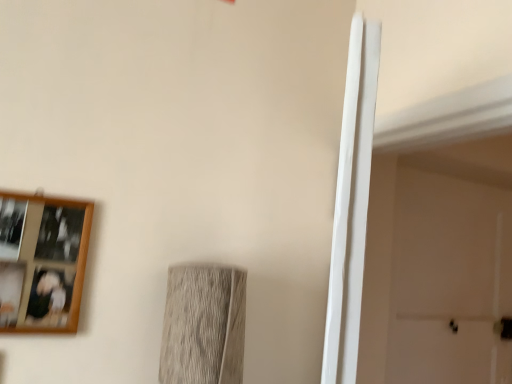
Question: Is wooden picture frame at upper left bigger or smaller than white matte door at right?

Choices:
 (A) small
 (B) big

Answer: (A)

Question: In terms of width, does wooden picture frame at upper left look wider or thinner when compared to white matte door at right?

Choices:
 (A) wide
 (B) thin

Answer: (B)

Question: Considering the positions of wooden picture frame at upper left and white matte door at right in the image, is wooden picture frame at upper left taller or shorter than white matte door at right?

Choices:
 (A) short
 (B) tall

Answer: (A)

Question: Is point (422, 238) closer or farther from the camera than point (52, 269)?

Choices:
 (A) closer
 (B) farther

Answer: (B)

Question: Is white matte door at right to the left or to the right of wooden picture frame at upper left in the image?

Choices:
 (A) left
 (B) right

Answer: (B)

Question: From a real-world perspective, is white matte door at right positioned above or below wooden picture frame at upper left?

Choices:
 (A) above
 (B) below

Answer: (A)

Question: In the image, is white matte door at right positioned in front of or behind wooden picture frame at upper left?

Choices:
 (A) behind
 (B) front

Answer: (A)